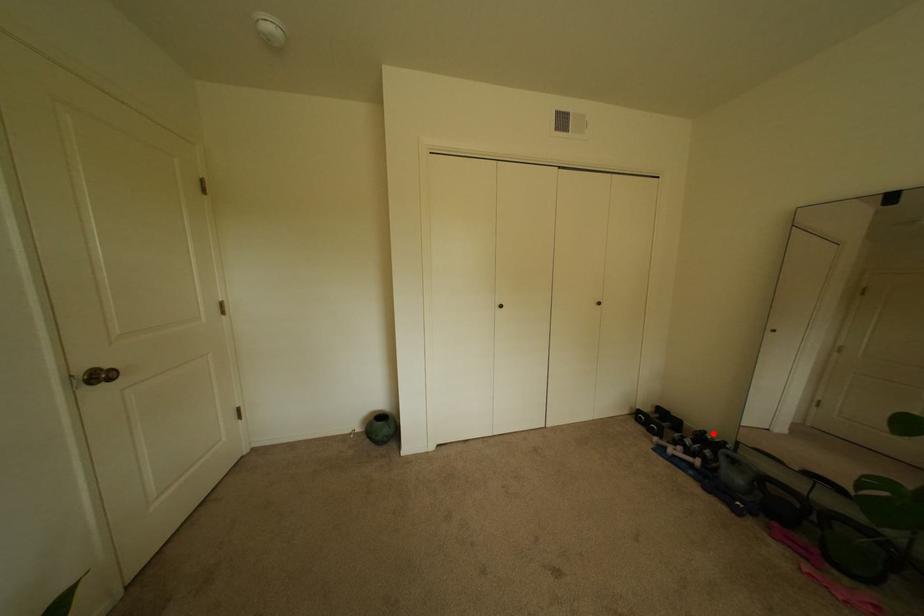
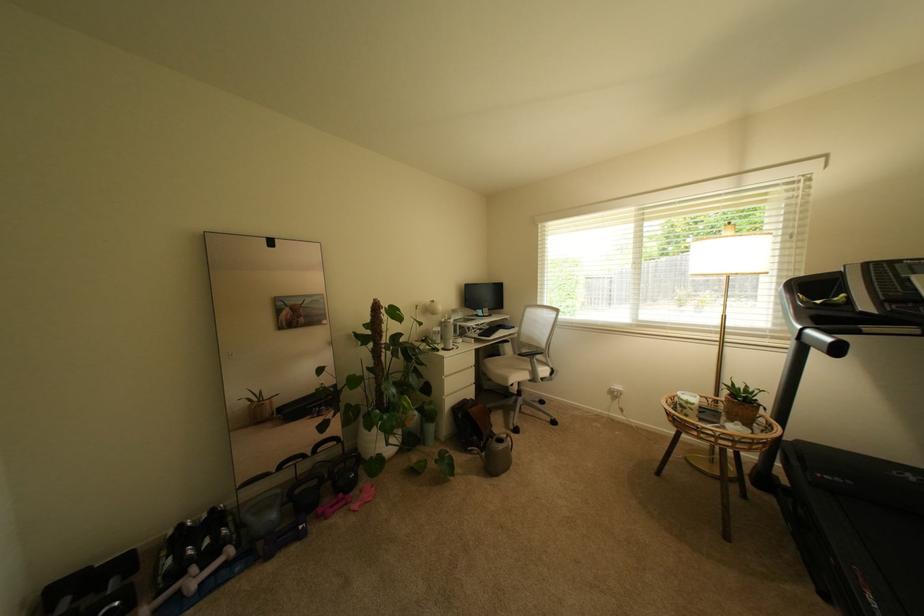
Question: I am providing you with two images of the same scene from different viewpoints. Image1 has a red point marked. In image2, the corresponding 3D location appears at what relative position? Reply with the corresponding letter.

Choices:
 (A) Closer
 (B) Farther

Answer: (A)